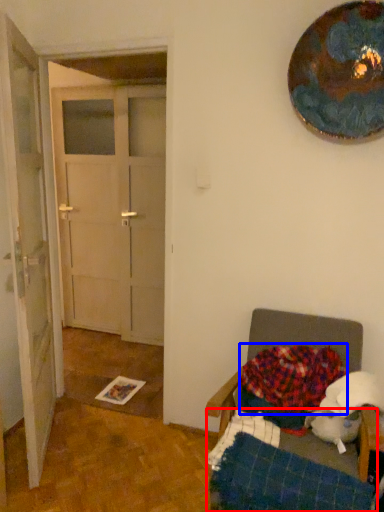
Question: Which of the following is the farthest to the observer, bed frame (highlighted by a red box) or blanket (highlighted by a blue box)?

Choices:
 (A) bed frame
 (B) blanket

Answer: (B)